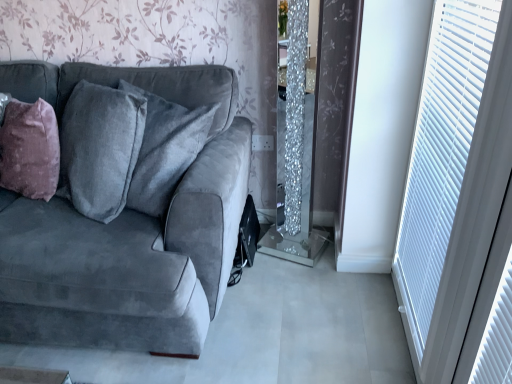
Question: From the image's perspective, is velvet gray couch at left under white plastic blinds at right?

Choices:
 (A) yes
 (B) no

Answer: (A)

Question: From a real-world perspective, is velvet gray couch at left on white plastic blinds at right?

Choices:
 (A) no
 (B) yes

Answer: (A)

Question: Is velvet gray couch at left smaller than white plastic blinds at right?

Choices:
 (A) no
 (B) yes

Answer: (A)

Question: Is velvet gray couch at left located outside white plastic blinds at right?

Choices:
 (A) yes
 (B) no

Answer: (A)

Question: Can you confirm if velvet gray couch at left is bigger than white plastic blinds at right?

Choices:
 (A) yes
 (B) no

Answer: (A)

Question: Is velvet gray couch at left thinner than white plastic blinds at right?

Choices:
 (A) yes
 (B) no

Answer: (B)

Question: Considering the relative positions of white plastic blinds at right and mauve velvet throw pillow at left in the image provided, is white plastic blinds at right to the left of mauve velvet throw pillow at left from the viewer's perspective?

Choices:
 (A) no
 (B) yes

Answer: (A)

Question: Would you say white plastic blinds at right is a long distance from mauve velvet throw pillow at left?

Choices:
 (A) yes
 (B) no

Answer: (A)

Question: From a real-world perspective, does white plastic blinds at right stand above mauve velvet throw pillow at left?

Choices:
 (A) no
 (B) yes

Answer: (B)

Question: Can you confirm if white plastic blinds at right is thinner than mauve velvet throw pillow at left?

Choices:
 (A) no
 (B) yes

Answer: (B)

Question: Can you confirm if white plastic blinds at right is smaller than mauve velvet throw pillow at left?

Choices:
 (A) yes
 (B) no

Answer: (A)

Question: Are white plastic blinds at right and mauve velvet throw pillow at left beside each other?

Choices:
 (A) no
 (B) yes

Answer: (A)

Question: Would you say mauve velvet throw pillow at left is part of velvet gray couch at left's contents?

Choices:
 (A) no
 (B) yes

Answer: (B)